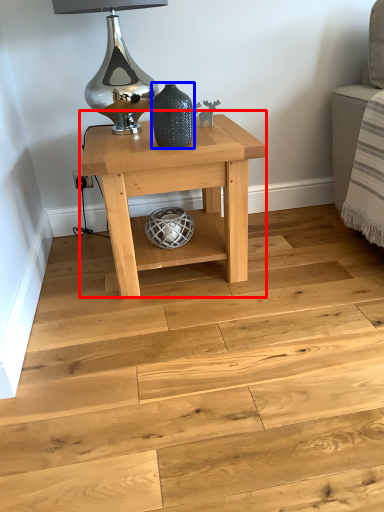
Question: Which object is further to the camera taking this photo, table (highlighted by a red box) or vase (highlighted by a blue box)?

Choices:
 (A) table
 (B) vase

Answer: (A)